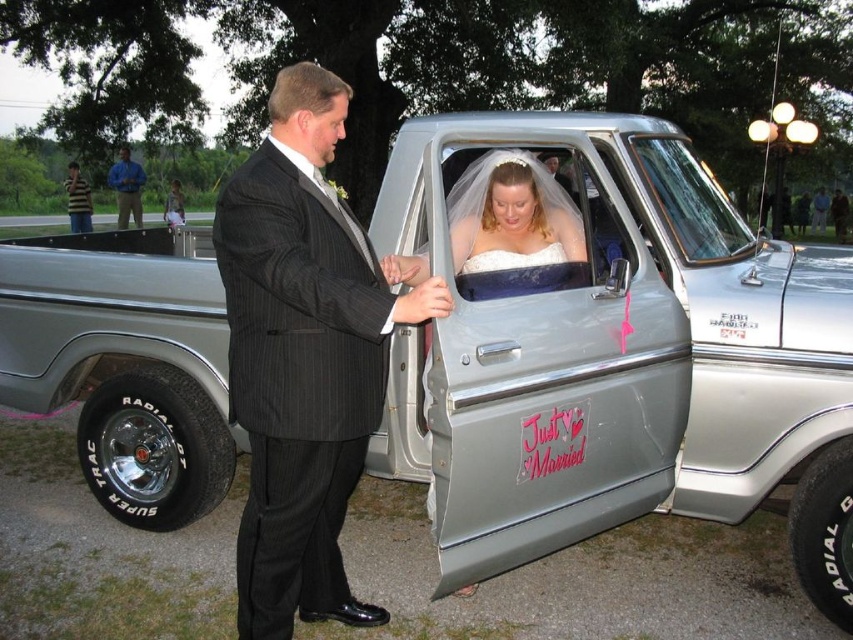
Question: Which point appears farthest from the camera in this image?

Choices:
 (A) (131, 168)
 (B) (136, 216)
 (C) (219, 234)
 (D) (477, 220)

Answer: (A)

Question: Among these objects, which one is nearest to the camera?

Choices:
 (A) blue shirt at left
 (B) white satin dress at center

Answer: (B)

Question: Is striped shirt at left thinner than blue shirt at left?

Choices:
 (A) yes
 (B) no

Answer: (A)

Question: Is black pinstripe suit at center further to the viewer compared to striped shirt at left?

Choices:
 (A) no
 (B) yes

Answer: (A)

Question: Does striped shirt at left lie behind blue shirt at left?

Choices:
 (A) no
 (B) yes

Answer: (B)

Question: Among these objects, which one is farthest from the camera?

Choices:
 (A) black pinstripe suit at center
 (B) blue shirt at left

Answer: (B)